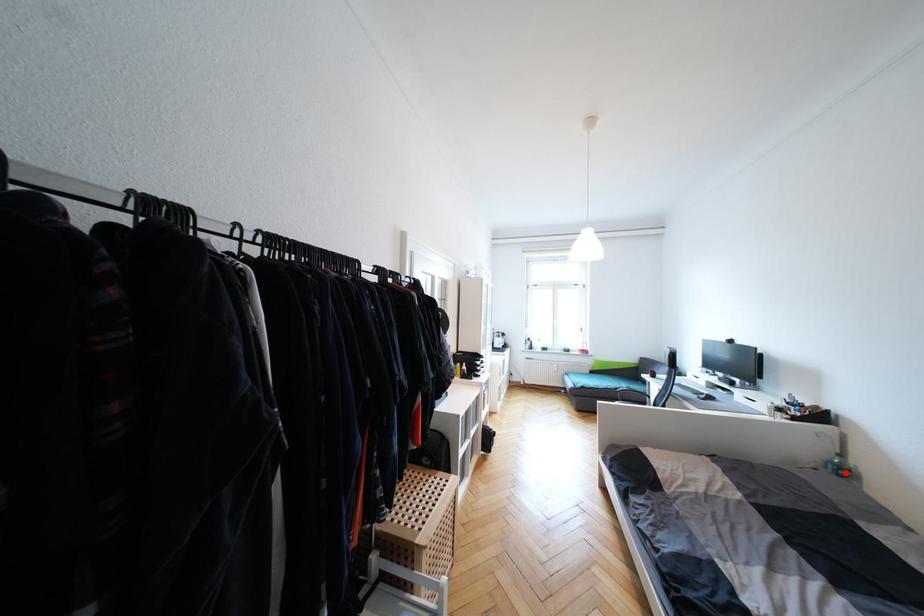
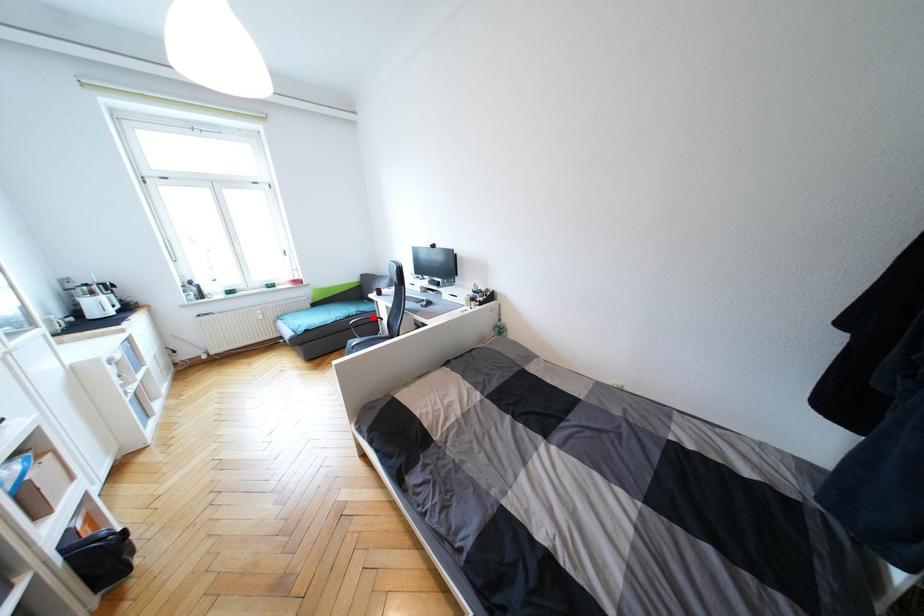
Consider the image. I am providing you with two images of the same scene from different viewpoints. A red point is marked on the first image and another point is marked on the second image. Are the points marked in image1 and image2 representing the same 3D position?

No